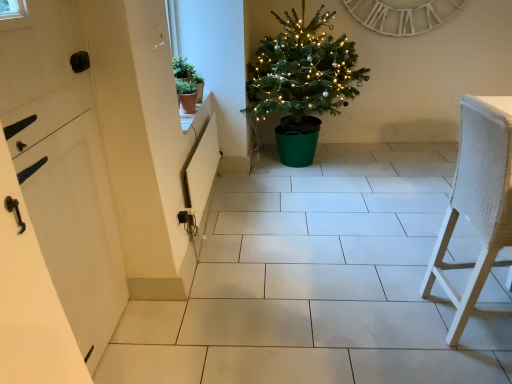
Question: From a real-world perspective, does white woven chair at right stand above white wooden clock at upper center?

Choices:
 (A) no
 (B) yes

Answer: (A)

Question: Is white woven chair at right facing away from white wooden clock at upper center?

Choices:
 (A) no
 (B) yes

Answer: (A)

Question: Can you confirm if white woven chair at right is thinner than white wooden clock at upper center?

Choices:
 (A) yes
 (B) no

Answer: (B)

Question: Considering the relative sizes of white woven chair at right and white wooden clock at upper center in the image provided, is white woven chair at right taller than white wooden clock at upper center?

Choices:
 (A) no
 (B) yes

Answer: (B)

Question: Considering the relative sizes of white woven chair at right and white wooden clock at upper center in the image provided, is white woven chair at right wider than white wooden clock at upper center?

Choices:
 (A) yes
 (B) no

Answer: (A)

Question: Can you confirm if white woven chair at right is smaller than white wooden clock at upper center?

Choices:
 (A) no
 (B) yes

Answer: (A)

Question: Is green matte plant pot at upper left, which is the second houseplant in bottom-to-top order, at the back of white woven chair at right?

Choices:
 (A) yes
 (B) no

Answer: (B)

Question: Would you say white woven chair at right contains green matte plant pot at upper left, which is the second houseplant in bottom-to-top order?

Choices:
 (A) no
 (B) yes

Answer: (A)

Question: Is white woven chair at right located outside green matte plant pot at upper left, which is the second houseplant in bottom-to-top order?

Choices:
 (A) no
 (B) yes

Answer: (B)

Question: From a real-world perspective, is white woven chair at right physically below green matte plant pot at upper left, the 1th houseplant from the top?

Choices:
 (A) no
 (B) yes

Answer: (B)

Question: Does white woven chair at right have a lesser height compared to green matte plant pot at upper left, which is the second houseplant in bottom-to-top order?

Choices:
 (A) no
 (B) yes

Answer: (A)

Question: Does white woven chair at right lie in front of green matte plant pot at upper left, which is the second houseplant in bottom-to-top order?

Choices:
 (A) yes
 (B) no

Answer: (A)

Question: From the image's perspective, does green plastic christmas tree at center appear lower than white wooden clock at upper center?

Choices:
 (A) yes
 (B) no

Answer: (A)